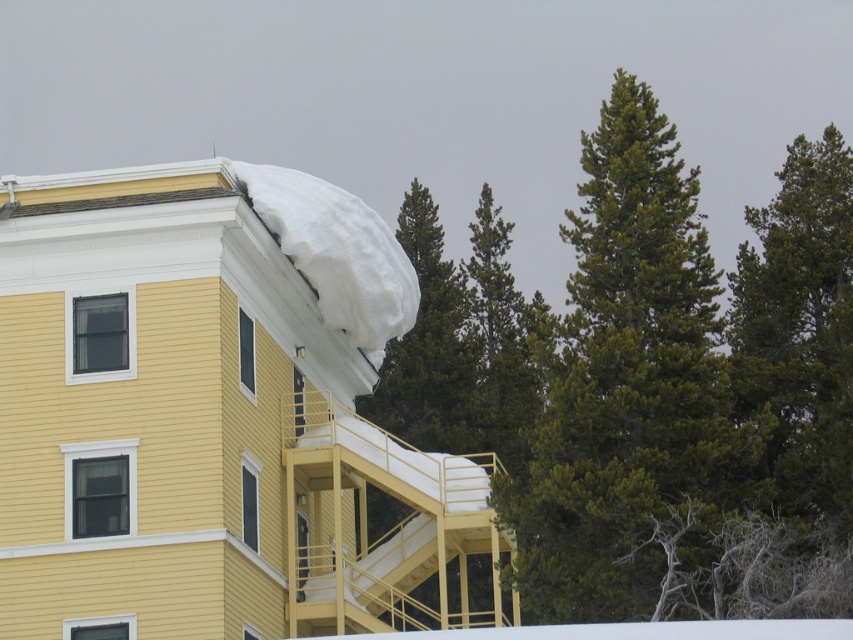
Question: Which object appears closest to the camera in this image?

Choices:
 (A) green needle-like tree at upper right
 (B) white fluffy snow at upper right

Answer: (A)

Question: Is green needle-like tree at upper right above white fluffy snow at upper right?

Choices:
 (A) yes
 (B) no

Answer: (A)

Question: Which point is closer to the camera?

Choices:
 (A) (299, 198)
 (B) (753, 451)

Answer: (B)

Question: Where is green needle-like tree at upper right located in relation to white fluffy snow at upper right in the image?

Choices:
 (A) below
 (B) above

Answer: (B)

Question: Does green needle-like tree at upper right appear under white fluffy snow at upper right?

Choices:
 (A) no
 (B) yes

Answer: (A)